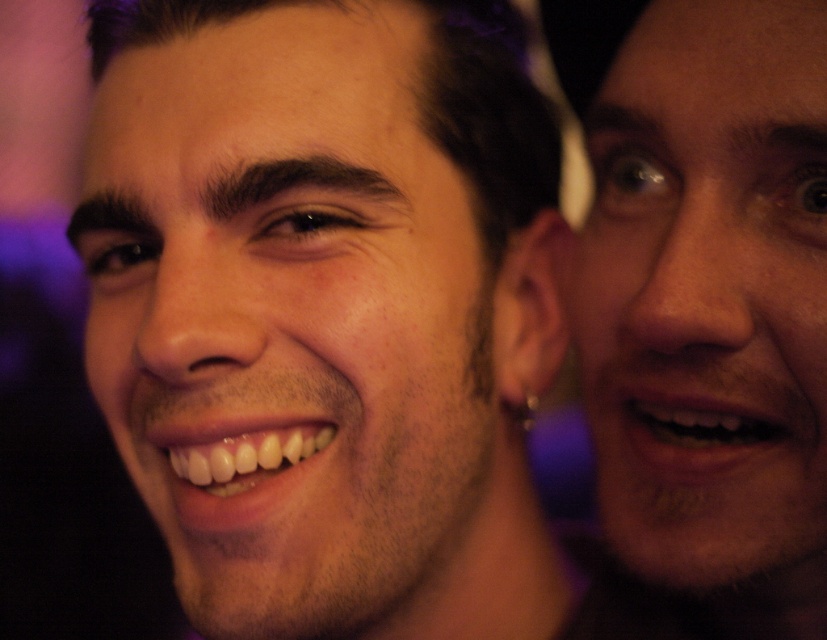
Question: Is smooth skin face at center to the left of smooth skin face at right from the viewer's perspective?

Choices:
 (A) yes
 (B) no

Answer: (A)

Question: Is smooth skin face at center to the left of smooth skin face at right from the viewer's perspective?

Choices:
 (A) no
 (B) yes

Answer: (B)

Question: Which point is closer to the camera taking this photo?

Choices:
 (A) (811, 166)
 (B) (367, 177)

Answer: (A)

Question: Does smooth skin face at center have a larger size compared to smooth skin face at right?

Choices:
 (A) no
 (B) yes

Answer: (B)